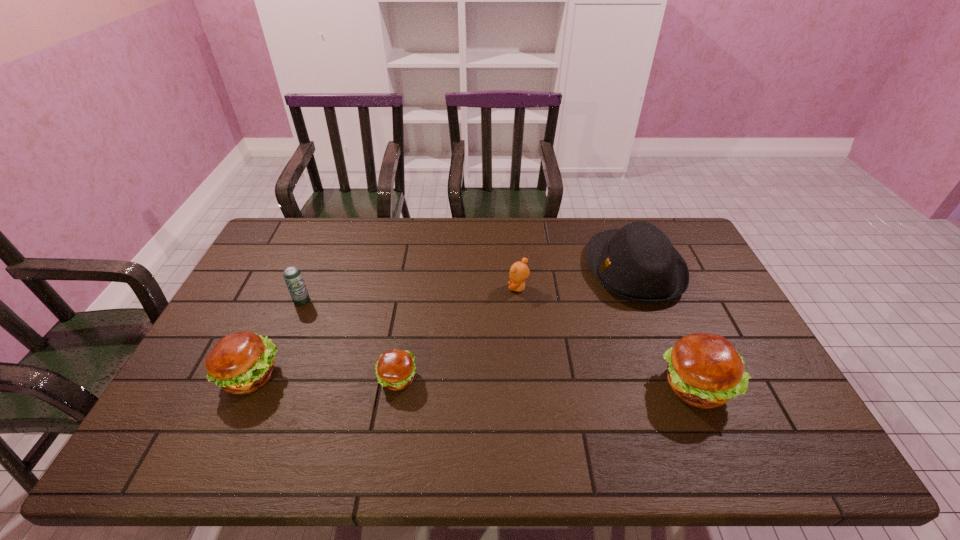
This screenshot has width=960, height=540. What are the coordinates of `vacant area that lies between the teddy bear and the second tallest hamburger` in the screenshot? It's located at (385, 332).

The height and width of the screenshot is (540, 960). Identify the location of vacant region between the shortest object and the third object from right to left. (458, 333).

Where is `empty space that is in between the teddy bear and the second hamburger from left to right`? empty space that is in between the teddy bear and the second hamburger from left to right is located at coordinates (458, 333).

I want to click on vacant region between the beer can and the fedora, so click(468, 285).

I want to click on free spot between the fedora and the shortest object, so click(x=516, y=323).

Where is `free spot between the shortest object and the leftmost hamburger`? free spot between the shortest object and the leftmost hamburger is located at coordinates (324, 377).

Identify the location of vacant area that lies between the fedora and the teddy bear. (576, 279).

The height and width of the screenshot is (540, 960). In order to click on free area in between the beer can and the second tallest hamburger in this screenshot , I will do `click(276, 338)`.

What are the coordinates of `vacant area between the shortest object and the rightmost hamburger` in the screenshot? It's located at (546, 382).

Locate which object ranks in proximity to the third object from right to left. Please provide its 2D coordinates. Your answer should be formatted as a tuple, i.e. [(x, y)], where the tuple contains the x and y coordinates of a point satisfying the conditions above.

[(637, 263)]